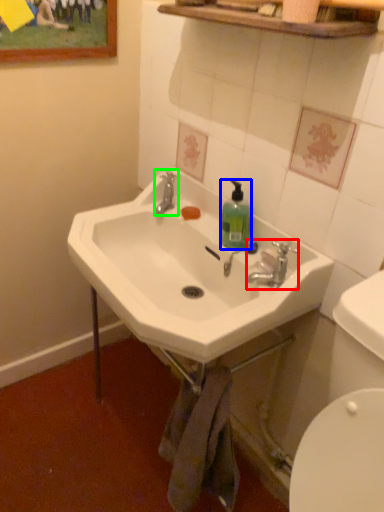
Question: Which object is positioned farthest from plumbing fixture (highlighted by a red box)? Select from bottle (highlighted by a blue box) and plumbing fixture (highlighted by a green box).

Choices:
 (A) bottle
 (B) plumbing fixture

Answer: (B)